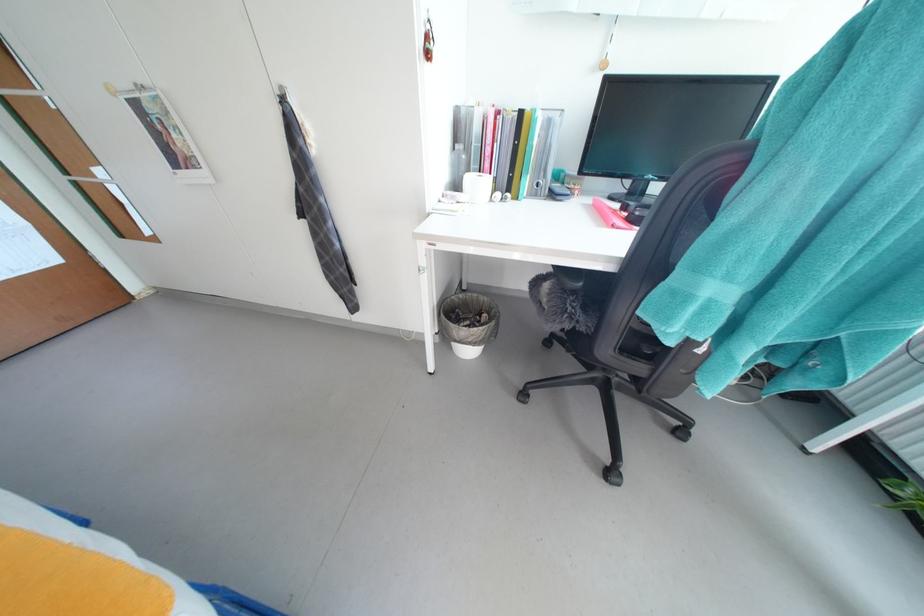
What do you see at coordinates (428, 41) in the screenshot?
I see `a metal wall clip` at bounding box center [428, 41].